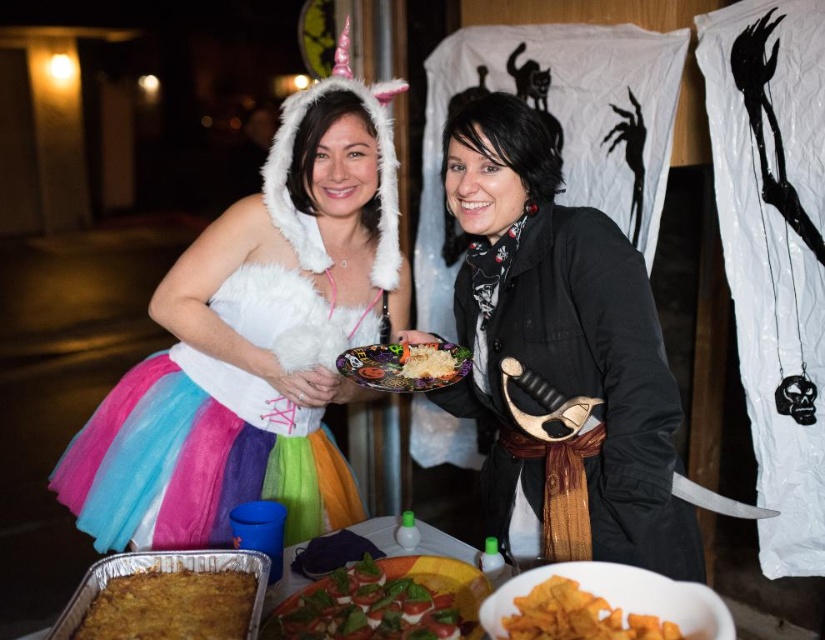
Does point (408, 616) come farther from viewer compared to point (365, 378)?

No, it is in front of (365, 378).

From the picture: Is fresh tomato salad at center bigger than matte plastic plate at center?

No, fresh tomato salad at center is not bigger than matte plastic plate at center.

Who is more distant from viewer, (416,634) or (338,372)?

The point (338,372) is more distant.

The width and height of the screenshot is (825, 640). In order to click on fresh tomato salad at center in this screenshot , I will do `click(385, 602)`.

Is golden crispy chips at lower center behind white fluffy rice at center?

No, it is not.

Is point (618, 618) farther from viewer compared to point (403, 371)?

That is False.

Where is `golden crispy chips at lower center`? golden crispy chips at lower center is located at coordinates (578, 616).

Between fresh tomato salad at center and white fluffy rice at center, which one appears on the right side from the viewer's perspective?

Positioned to the right is white fluffy rice at center.

Does fresh tomato salad at center have a greater height compared to white fluffy rice at center?

Yes, fresh tomato salad at center is taller than white fluffy rice at center.

Between point (467, 588) and point (430, 349), which one is positioned in front?

Positioned in front is point (467, 588).

This screenshot has width=825, height=640. Find the location of `fresh tomato salad at center`. fresh tomato salad at center is located at coordinates (385, 602).